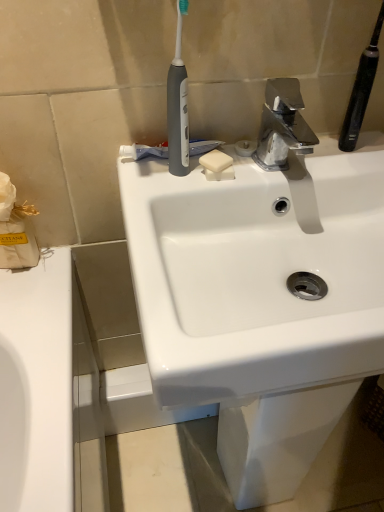
Where is `space that is in front of gray matte toothbrush at upper center, which ranks as the second toothbrush in right-to-left order`? The height and width of the screenshot is (512, 384). space that is in front of gray matte toothbrush at upper center, which ranks as the second toothbrush in right-to-left order is located at coordinates (158, 200).